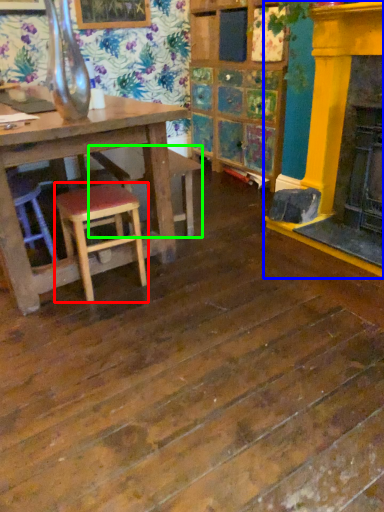
Question: Estimate the real-world distances between objects in this image. Which object is closer to stool (highlighted by a red box), fireplace (highlighted by a blue box) or bar stool (highlighted by a green box)?

Choices:
 (A) fireplace
 (B) bar stool

Answer: (B)